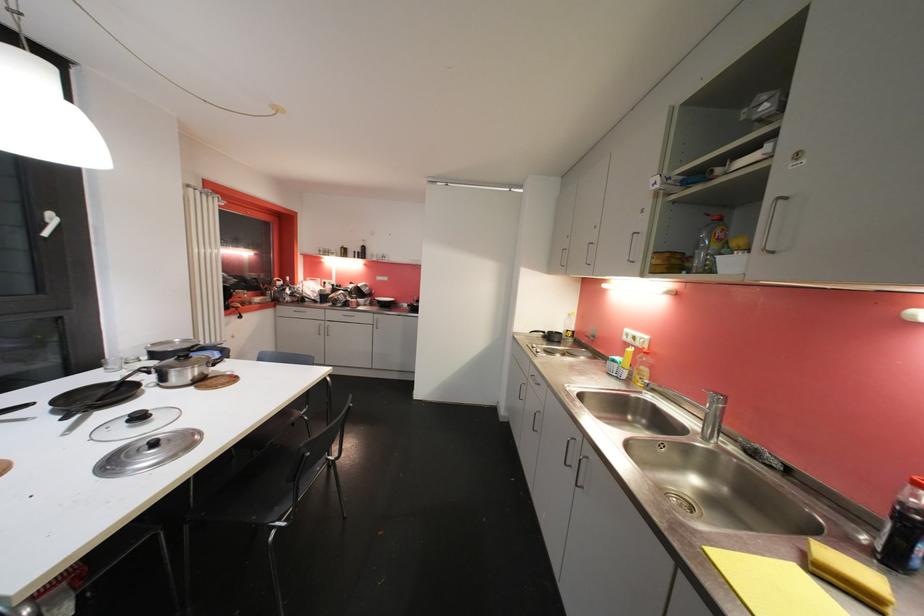
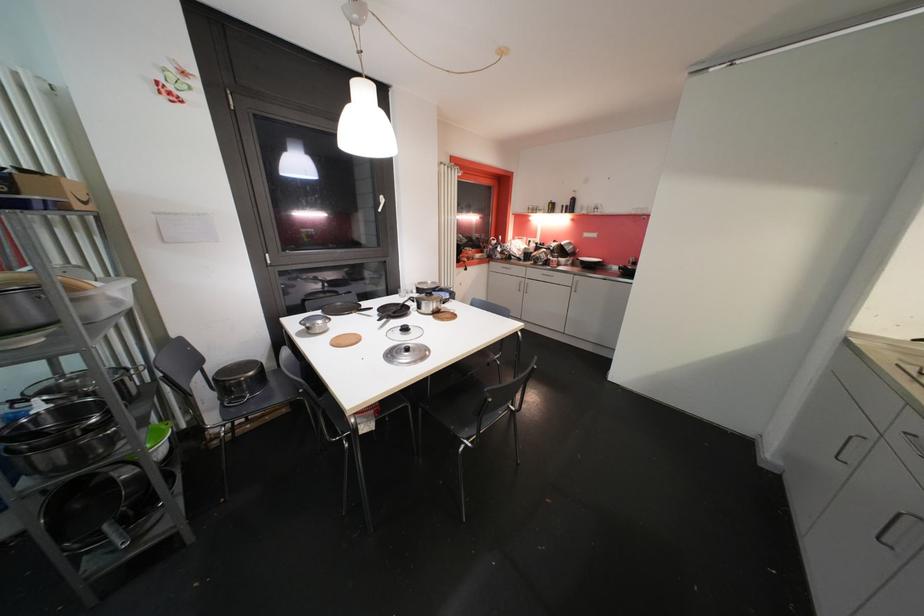
Question: How did the camera likely rotate?

Choices:
 (A) Left
 (B) Right
 (C) Up
 (D) Down

Answer: (A)